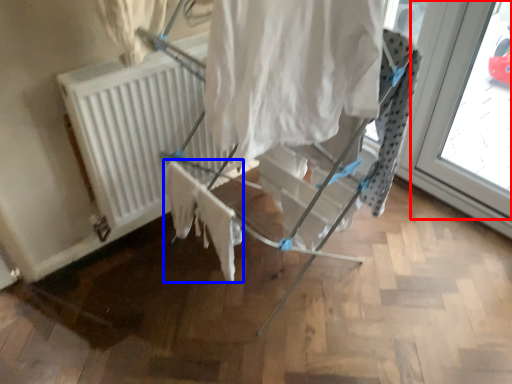
Question: Which of the following is the farthest to the observer, window (highlighted by a red box) or fabric (highlighted by a blue box)?

Choices:
 (A) window
 (B) fabric

Answer: (A)